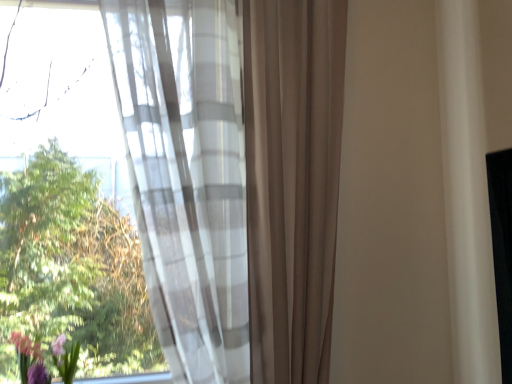
Find the location of a particular element. This screenshot has width=512, height=384. purple matte floral arrangement at lower left is located at coordinates (30, 360).

Describe the element at coordinates (30, 360) in the screenshot. The image size is (512, 384). I see `purple matte floral arrangement at lower left` at that location.

What is the approximate height of sheer white curtain at left?

4.44 feet.

I want to click on sheer white curtain at left, so click(x=234, y=178).

What is the approximate width of sheer white curtain at left?

sheer white curtain at left is 10.11 inches in width.

The width and height of the screenshot is (512, 384). Describe the element at coordinates (234, 178) in the screenshot. I see `sheer white curtain at left` at that location.

At what (x,y) coordinates should I click in order to perform the action: click on purple matte floral arrangement at lower left. Please return your answer as a coordinate pair (x, y). This screenshot has width=512, height=384. Looking at the image, I should click on (30, 360).

Which object is positioned more to the right, sheer white curtain at left or purple matte floral arrangement at lower left?

sheer white curtain at left is more to the right.

Is sheer white curtain at left positioned before purple matte floral arrangement at lower left?

Yes, it is.

Does point (215, 187) come behind point (72, 367)?

No, (215, 187) is closer to viewer.

From the image's perspective, relative to purple matte floral arrangement at lower left, is sheer white curtain at left above or below?

sheer white curtain at left is situated higher than purple matte floral arrangement at lower left in the image.

From a real-world perspective, which object stands above the other?

sheer white curtain at left is physically above.

Based on the photo, does sheer white curtain at left have a lesser width compared to purple matte floral arrangement at lower left?

Incorrect, the width of sheer white curtain at left is not less than that of purple matte floral arrangement at lower left.

Which of these two, sheer white curtain at left or purple matte floral arrangement at lower left, stands taller?

With more height is sheer white curtain at left.

Is sheer white curtain at left bigger or smaller than purple matte floral arrangement at lower left?

Clearly, sheer white curtain at left is larger in size than purple matte floral arrangement at lower left.

Is sheer white curtain at left not within purple matte floral arrangement at lower left?

sheer white curtain at left is positioned outside purple matte floral arrangement at lower left.

Is sheer white curtain at left not near purple matte floral arrangement at lower left?

No, sheer white curtain at left is in close proximity to purple matte floral arrangement at lower left.

Is sheer white curtain at left positioned with its back to purple matte floral arrangement at lower left?

No.

How many degrees apart are the facing directions of sheer white curtain at left and purple matte floral arrangement at lower left?

The facing directions of sheer white curtain at left and purple matte floral arrangement at lower left are 0.00125 degrees apart.

Image resolution: width=512 pixels, height=384 pixels. I want to click on floral arrangement below the sheer white curtain at left (from a real-world perspective), so click(x=30, y=360).

Does purple matte floral arrangement at lower left appear on the left side of sheer white curtain at left?

Yes.

Is the depth of purple matte floral arrangement at lower left greater than that of sheer white curtain at left?

Yes, purple matte floral arrangement at lower left is behind sheer white curtain at left.

Is point (41, 358) farther from viewer compared to point (267, 152)?

Yes, it is behind point (267, 152).

Based on the photo, from the image's perspective, is purple matte floral arrangement at lower left above sheer white curtain at left?

Answer: Incorrect, from the image's perspective, purple matte floral arrangement at lower left is lower than sheer white curtain at left.

From a real-world perspective, which is physically below, purple matte floral arrangement at lower left or sheer white curtain at left?

purple matte floral arrangement at lower left, from a real-world perspective.

Considering the relative sizes of purple matte floral arrangement at lower left and sheer white curtain at left in the image provided, is purple matte floral arrangement at lower left wider than sheer white curtain at left?

No, purple matte floral arrangement at lower left is not wider than sheer white curtain at left.

From the picture: In terms of height, does purple matte floral arrangement at lower left look taller or shorter compared to sheer white curtain at left?

In the image, purple matte floral arrangement at lower left appears to be shorter than sheer white curtain at left.

Which of these two, purple matte floral arrangement at lower left or sheer white curtain at left, is smaller?

With smaller size is purple matte floral arrangement at lower left.

Is sheer white curtain at left completely or partially inside purple matte floral arrangement at lower left?

Actually, sheer white curtain at left is outside purple matte floral arrangement at lower left.

Is purple matte floral arrangement at lower left in contact with sheer white curtain at left?

purple matte floral arrangement at lower left and sheer white curtain at left are not in contact.

Is purple matte floral arrangement at lower left facing towards sheer white curtain at left?

No, purple matte floral arrangement at lower left is not facing towards sheer white curtain at left.

How many degrees apart are the facing directions of purple matte floral arrangement at lower left and sheer white curtain at left?

purple matte floral arrangement at lower left and sheer white curtain at left are facing 0.00125 degrees away from each other.

You are a GUI agent. You are given a task and a screenshot of the screen. Output one action in this format:
    pyautogui.click(x=<x>, y=<y>)
    Task: Click on the floral arrangement that appears below the sheer white curtain at left (from a real-world perspective)
    
    Given the screenshot: What is the action you would take?
    pyautogui.click(x=30, y=360)

Image resolution: width=512 pixels, height=384 pixels. Identify the location of curtain on the right of purple matte floral arrangement at lower left. (234, 178).

Locate an element on the screen. The image size is (512, 384). floral arrangement lying behind the sheer white curtain at left is located at coordinates (30, 360).